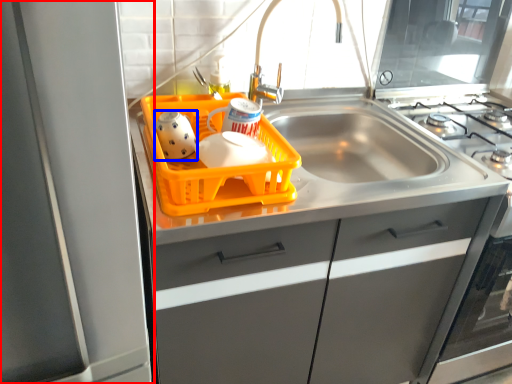
Question: Which object appears farthest to the camera in this image, appliance (highlighted by a red box) or tea pot (highlighted by a blue box)?

Choices:
 (A) appliance
 (B) tea pot

Answer: (B)